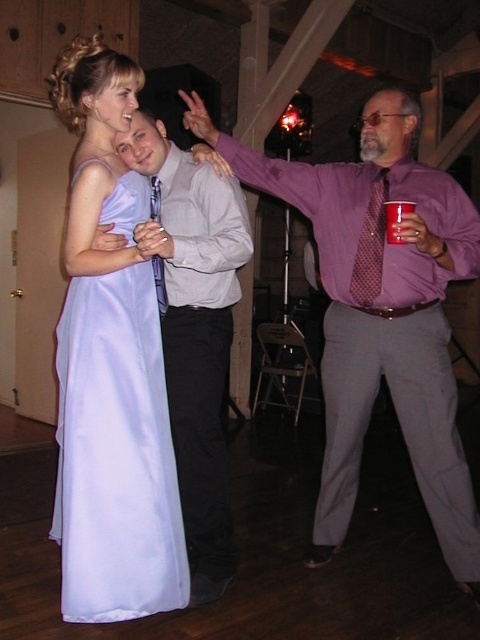
You are organizing a clothing donation drive and need to ensure items fit into standard donation boxes. The donation box has a minimum size requirement of 12 inches in length. Given the information about the matte gray shirt at center and the matte blue tie at center, which item would you prioritize placing into the box first?

The matte gray shirt at center has a larger size compared to the matte blue tie at center, so the matte gray shirt at center would be prioritized first as it meets the minimum size requirement of 12 inches more likely than the smaller tie.

You are a photographer at the event and want to capture a closeup of the polka dot silk tie at right. Based on its position, where should you aim your camera?

The polka dot silk tie at right is positioned at coordinates point (371, 244), so aim your camera at that point to capture the closeup.

You are standing in the center of the dance floor and see two points marked in the image. Which point, point (x=354, y=294) or point (x=395, y=225), is closer to you?

Point (x=354, y=294) is closer to you because it is further to the viewer than point (x=395, y=225).